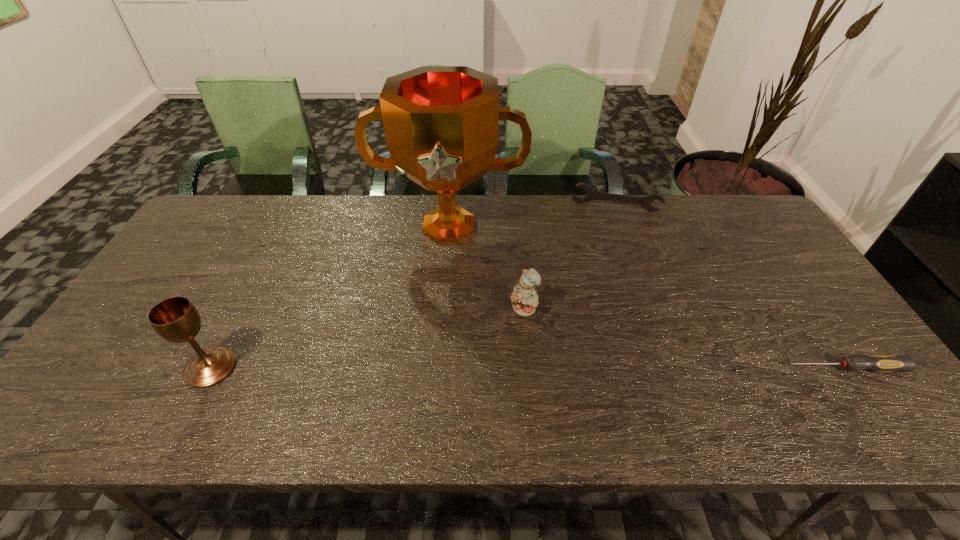
This screenshot has width=960, height=540. Find the location of `empty space between the wrench and the award`. empty space between the wrench and the award is located at coordinates (532, 217).

The height and width of the screenshot is (540, 960). What are the coordinates of `blank region between the award and the fourth shortest object` in the screenshot? It's located at (330, 297).

This screenshot has width=960, height=540. In order to click on free space between the tallest object and the third nearest object in this screenshot , I will do `click(486, 269)`.

Where is `free space that is in between the third nearest object and the fourth shortest object`? free space that is in between the third nearest object and the fourth shortest object is located at coordinates (367, 339).

Locate which object is the second closest to the third shortest object. Please provide its 2D coordinates. Your answer should be formatted as a tuple, i.e. [(x, y)], where the tuple contains the x and y coordinates of a point satisfying the conditions above.

[(592, 194)]

Identify the location of the fourth closest object to the shortest object. (175, 319).

Locate an element on the screen. This screenshot has width=960, height=540. vacant space that satisfies the following two spatial constraints: 1. on the back side of the tallest object; 2. on the left side of the fourth tallest object is located at coordinates (450, 207).

At what (x,y) coordinates should I click in order to perform the action: click on free space in the image that satisfies the following two spatial constraints: 1. on the front side of the fourth object from left to right; 2. insert the screwdriver into a screw head. Please return your answer as a coordinate pair (x, y). Image resolution: width=960 pixels, height=540 pixels. Looking at the image, I should click on (674, 368).

You are a GUI agent. You are given a task and a screenshot of the screen. Output one action in this format:
    pyautogui.click(x=<x>, y=<y>)
    Task: Click on the free spot that satisfies the following two spatial constraints: 1. on the back side of the second tallest object; 2. on the right side of the teddy bear
    The width and height of the screenshot is (960, 540).
    Given the screenshot: What is the action you would take?
    pyautogui.click(x=240, y=310)

The image size is (960, 540). Find the location of `vacant area in the image that satisfies the following two spatial constraints: 1. on the front side of the wrench; 2. insert the rightmost object into a screw head`. vacant area in the image that satisfies the following two spatial constraints: 1. on the front side of the wrench; 2. insert the rightmost object into a screw head is located at coordinates (674, 368).